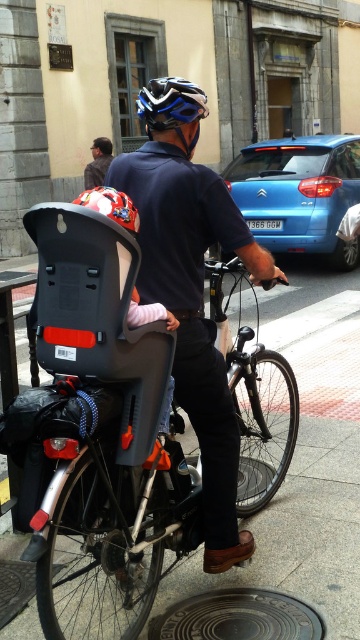
Based on the scene description, where is the matte gray plastic baby carriage at center located in the image?

The matte gray plastic baby carriage at center is located at point (82, 291).

You are standing on the sidewalk and looking at the scene. Which of the two points, point (73,214) or point (194,100), is closer to you?

Point (73,214) is closer to you than point (194,100).